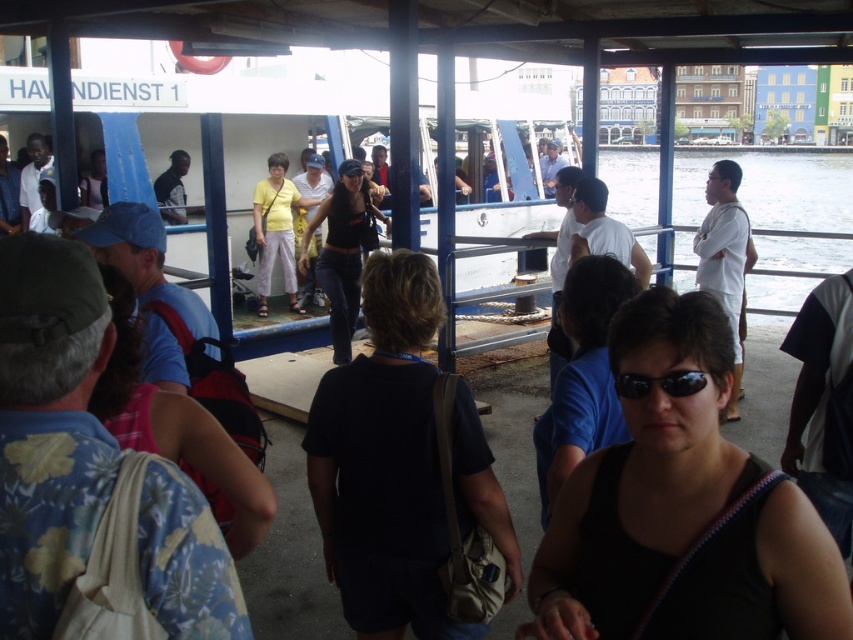
You are a traveler at the ferry terminal and want to check if your black matte sunglasses at center can fit in the same pocket as your matte blue cap at center. Which one is taller?

The black matte sunglasses at center is shorter than the matte blue cap at center, so the matte blue cap at center is taller and may not fit in the same pocket as the sunglasses.

You are a photographer trying to capture a candid shot of the black denim jeans at center and the black plastic sunglasses at center. Since you want to ensure both are in the frame, can you determine if they are positioned side by side or if one is to the left of the other?

The black denim jeans at center are to the left of the black plastic sunglasses at center, so they are positioned side by side with the jeans on the left and the sunglasses on the right.